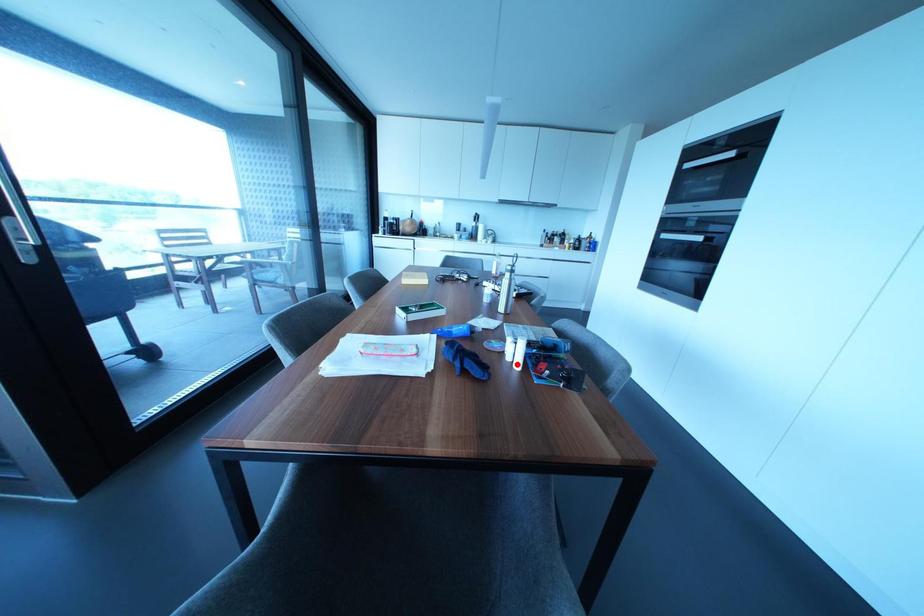
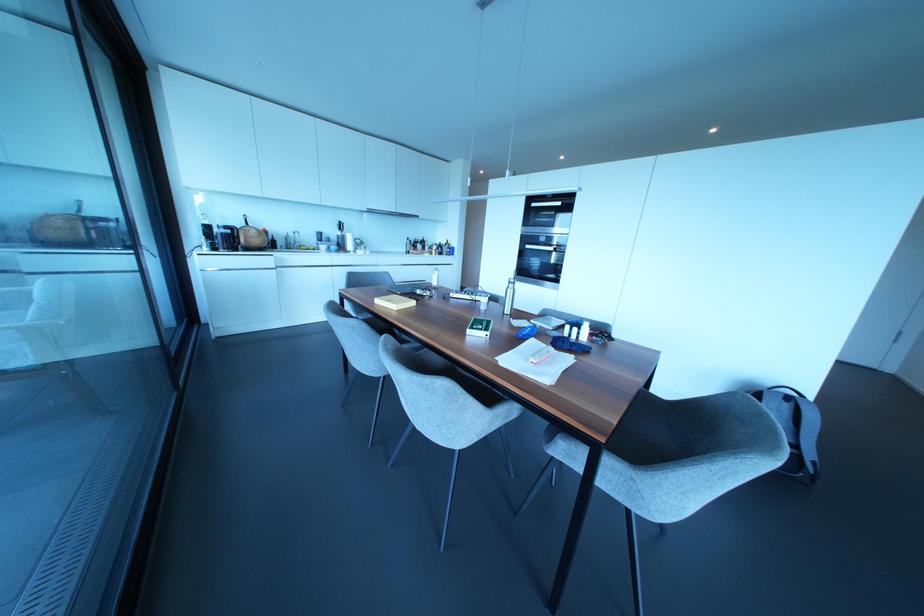
The point at the highlighted location is marked in the first image. Where is the corresponding point in the second image?

(584, 338)